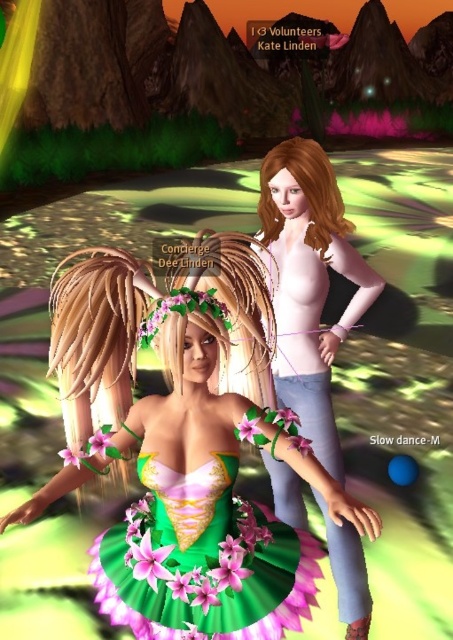
Can you confirm if green floral dress at center is smaller than pink matte dress at center?

Correct, green floral dress at center occupies less space than pink matte dress at center.

Who is more forward, [114,403] or [345,545]?

Positioned in front is point [114,403].

The image size is (453, 640). In order to click on green floral dress at center in this screenshot , I will do `click(183, 444)`.

From the picture: Who is more distant from viewer, (8, 524) or (193, 588)?

The point (8, 524) is more distant.

Is point (294, 616) in front of point (255, 634)?

No, it is behind (255, 634).

This screenshot has height=640, width=453. Identify the location of green floral dress at center. (183, 444).

Which is above, green satin corset at center or pink matte dress at center?

pink matte dress at center is above.

Is point (207, 515) farther from camera compared to point (287, 195)?

No, (207, 515) is closer to viewer.

Find the location of a particular element. green satin corset at center is located at coordinates (202, 561).